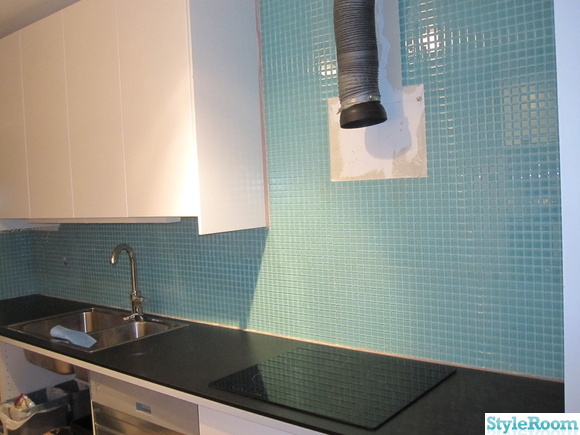
At what (x,y) coordinates should I click in order to perform the action: click on rightmost cabinet. Please return your answer as a coordinate pair (x, y). Looking at the image, I should click on (152, 158).